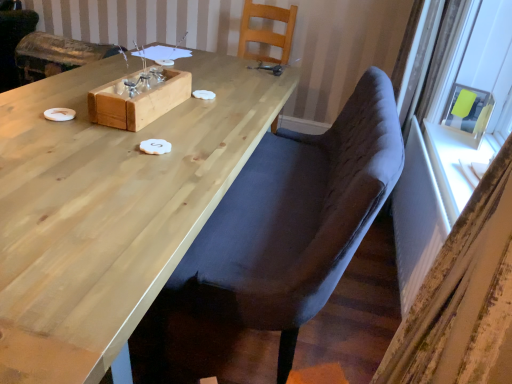
Image resolution: width=512 pixels, height=384 pixels. In order to click on free point above wooden box at center (from a real-world perspective) in this screenshot , I will do `click(143, 80)`.